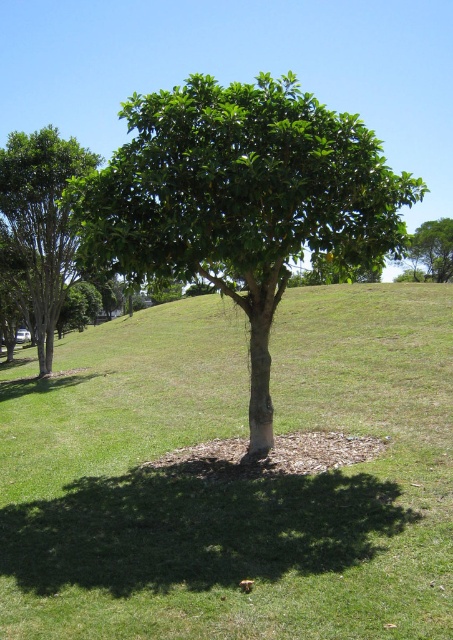
You are standing in the middle of a park and see the green leafy tree at center and the green leafy tree at left. Which tree is nearer to you?

The green leafy tree at center is closer to the viewer than the green leafy tree at left, so the green leafy tree at center is nearer to you.

You are standing in the middle of the green grass at center and want to walk to the edge of the green leafy tree at left. Which direction should you head towards?

Since the green grass at center is located below the green leafy tree at left, you should head towards the north direction to reach the edge of the green leafy tree at left.